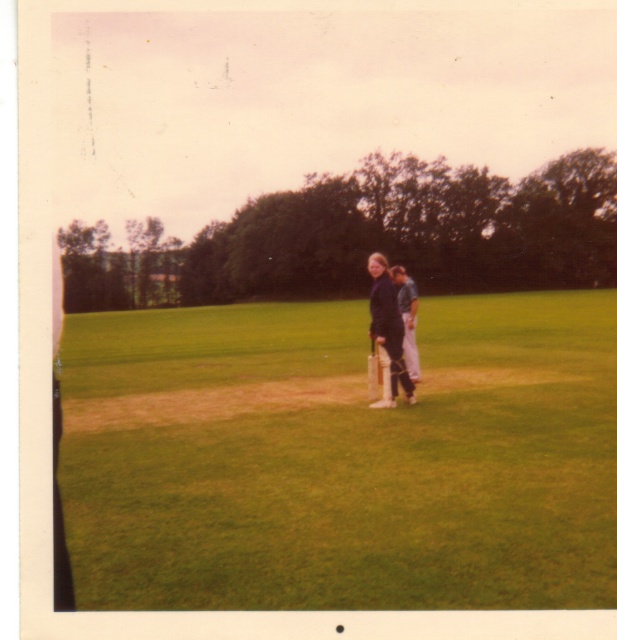
Who is more forward, (x=375, y=330) or (x=415, y=337)?

Point (x=375, y=330)

Does point (394, 333) come closer to viewer compared to point (412, 333)?

Yes, point (394, 333) is closer to viewer.

The height and width of the screenshot is (640, 617). What are the coordinates of `dark blue fabric jacket at center` in the screenshot? It's located at (387, 332).

Describe the element at coordinates (407, 317) in the screenshot. I see `dark blue fabric shirt at center` at that location.

This screenshot has height=640, width=617. What are the coordinates of `dark blue fabric shirt at center` in the screenshot? It's located at click(407, 317).

At what (x,y) coordinates should I click in order to perform the action: click on dark blue fabric shirt at center. Please return your answer as a coordinate pair (x, y). This screenshot has width=617, height=640. Looking at the image, I should click on click(407, 317).

Who is lower down, green grass at center or wooden baseball bat at center?

wooden baseball bat at center is below.

At what (x,y) coordinates should I click in order to perform the action: click on green grass at center. Please return your answer as a coordinate pair (x, y). Looking at the image, I should click on pyautogui.click(x=342, y=458).

Who is more forward, (536,456) or (378,349)?

Point (536,456) is in front.

Find the location of a particular element. green grass at center is located at coordinates (342, 458).